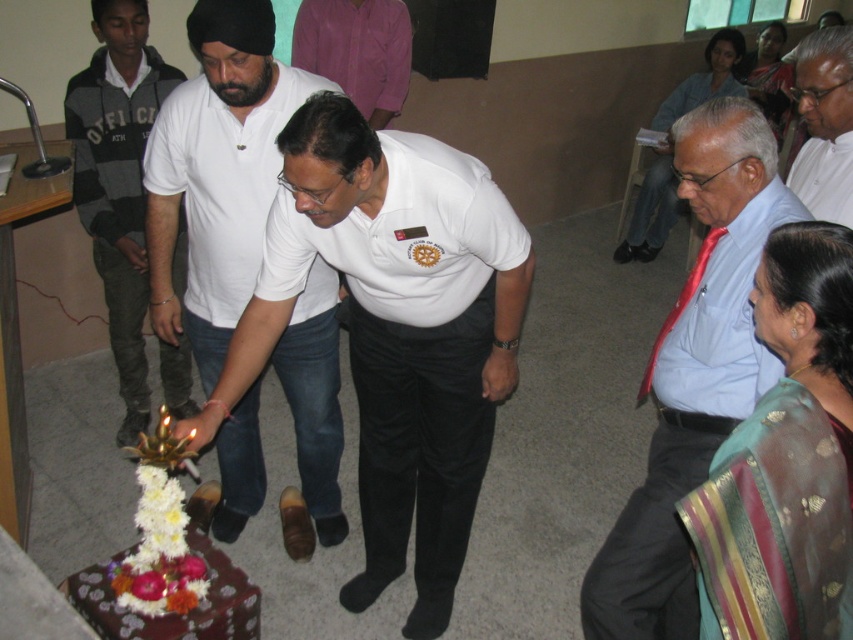
You are a photographer at the event and need to capture a photo of both the light blue shirt at center and the white shirt at center. Since you can only focus on one person at a time, which person should you focus on first to ensure both are in the frame?

The light blue shirt at center is to the left of white shirt at center, so you should focus on the light blue shirt at center first to ensure both are in the frame.

What are the coordinates of the white cotton shirt at center?

The white cotton shirt at center is located at coordinates point [218,172].